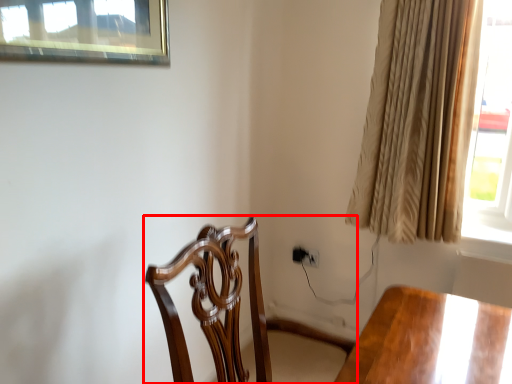
Question: Observing the image, what is the correct spatial positioning of chair (annotated by the red box) in reference to curtain?

Choices:
 (A) left
 (B) right

Answer: (A)